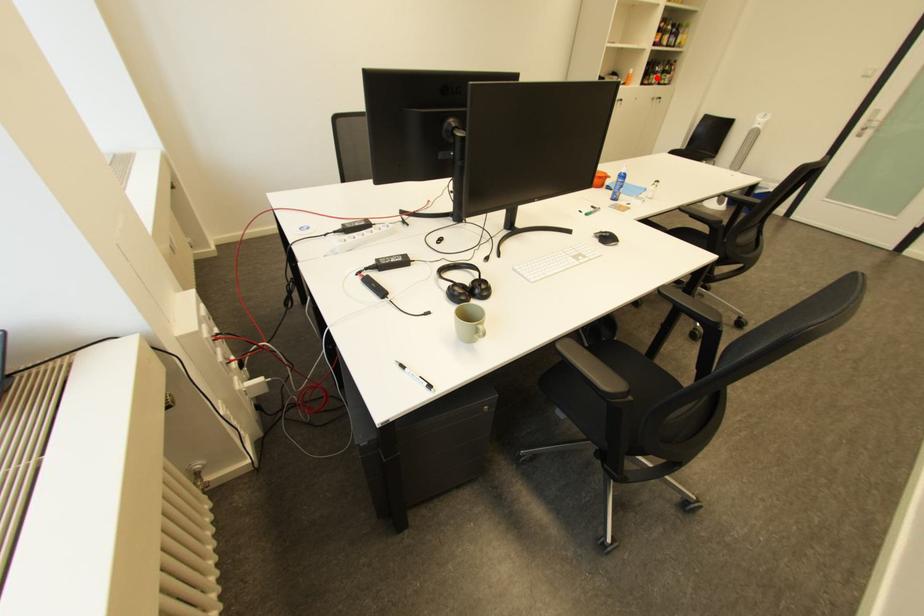
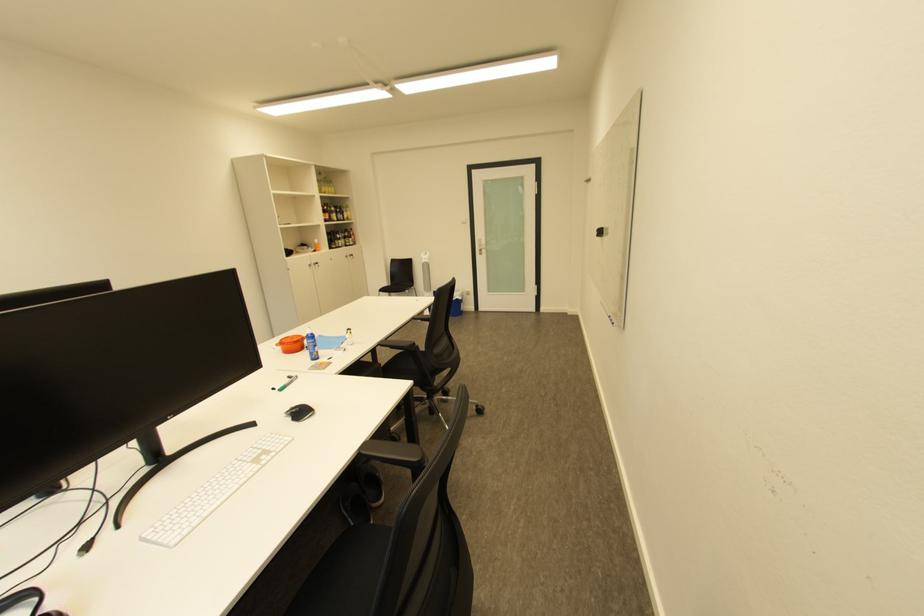
The point at the highlighted location is marked in the first image. Where is the corresponding point in the second image?

(343, 244)